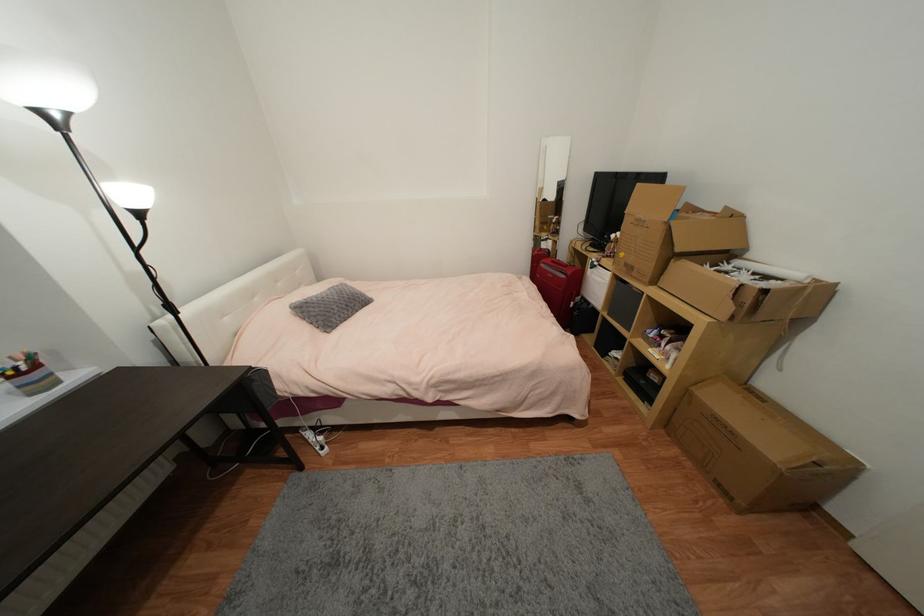
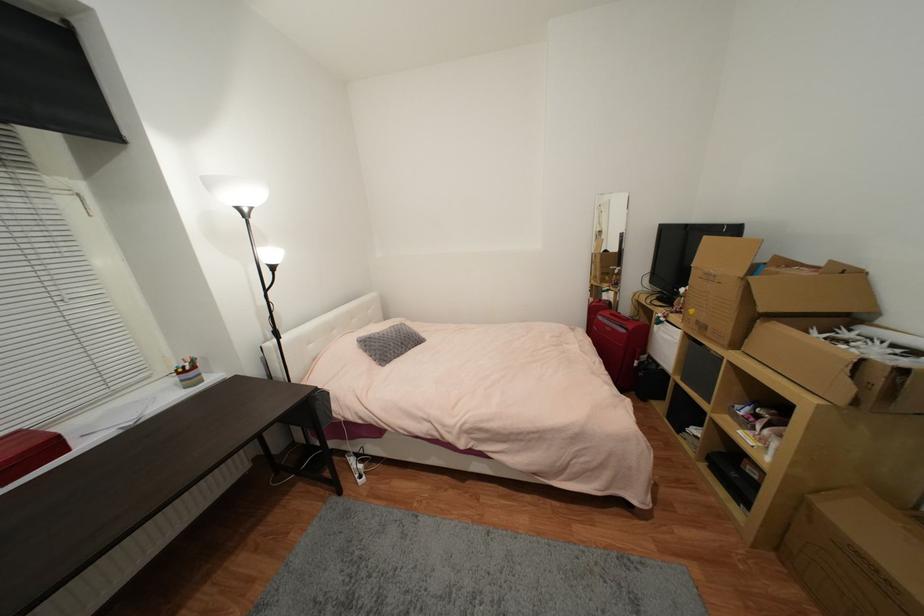
Find the pixel in the second image that matches point 546,267 in the first image.

(603, 318)